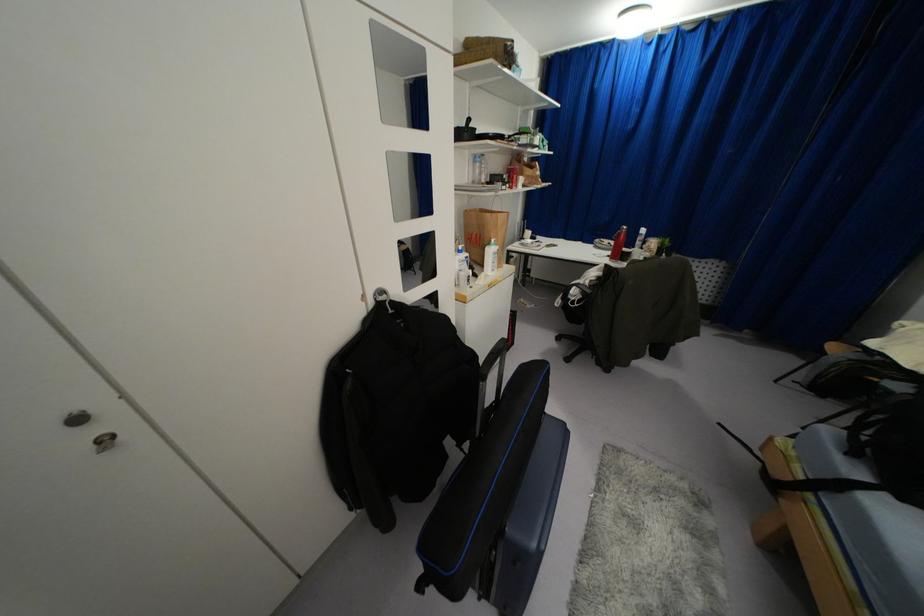
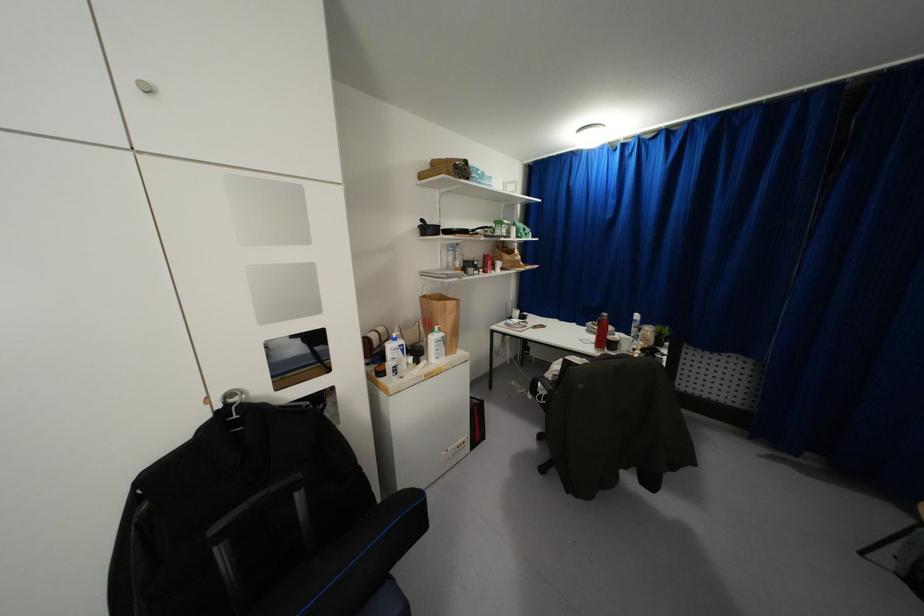
Question: The images are taken continuously from a first-person perspective. In which direction is your viewpoint rotating?

Choices:
 (A) Left
 (B) Right
 (C) Up
 (D) Down

Answer: (C)